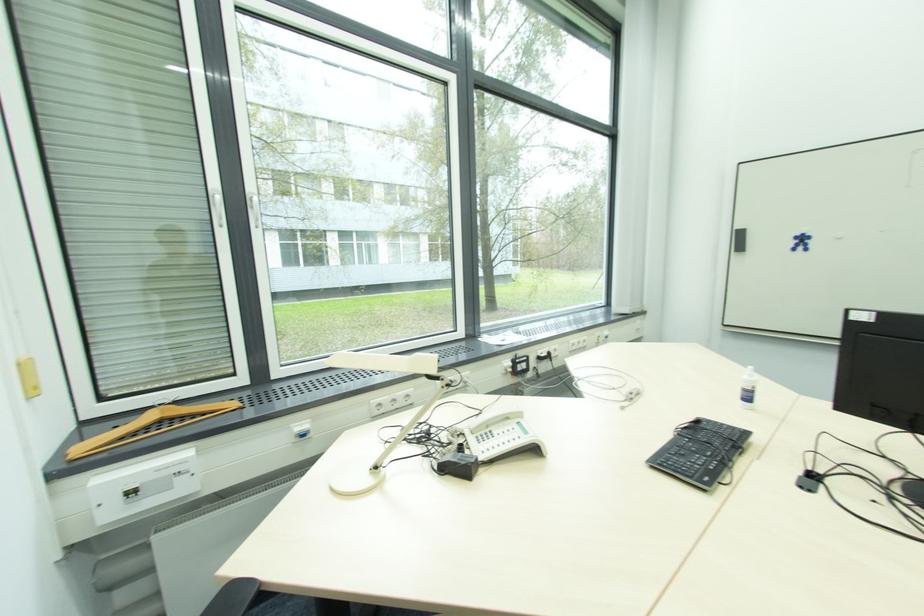
What do you see at coordinates (699, 452) in the screenshot? I see `a telephone keypad` at bounding box center [699, 452].